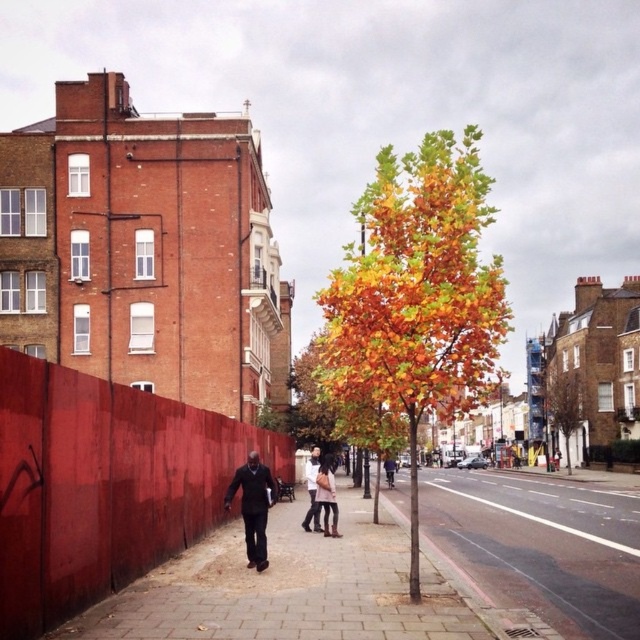
You are a delivery person carrying a heavy box and need to move from the brick pavement at left to the smooth concrete pavement at center. Which pavement will be easier to walk on and why?

The smooth concrete pavement at center will be easier to walk on because it has a greater height than the brick pavement at left, providing a more stable surface.

You are a pedestrian walking on the smooth concrete pavement at center. You want to reach the autumn leaves tree at center. Which direction should you move towards?

You should move to your left since the autumn leaves tree at center is to the left of smooth concrete pavement at center.